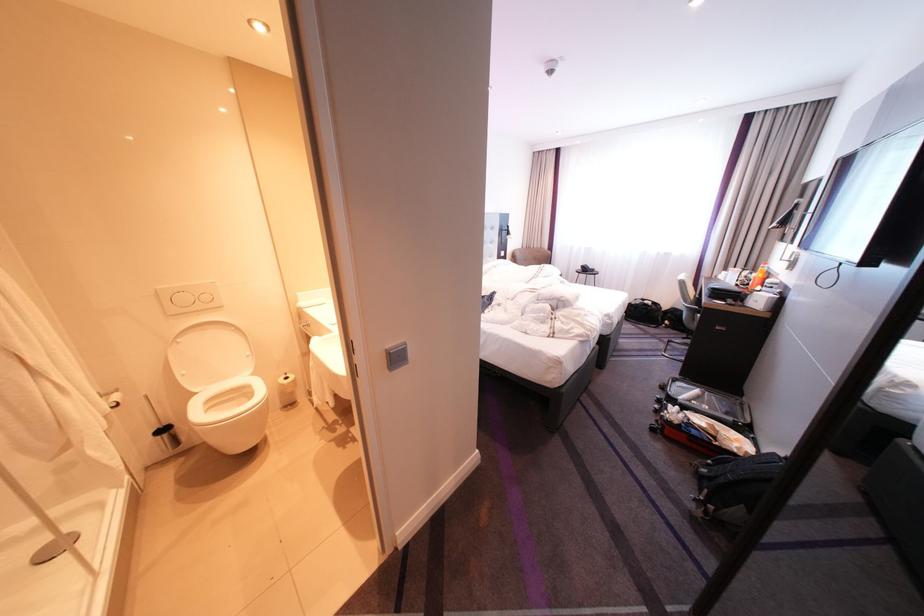
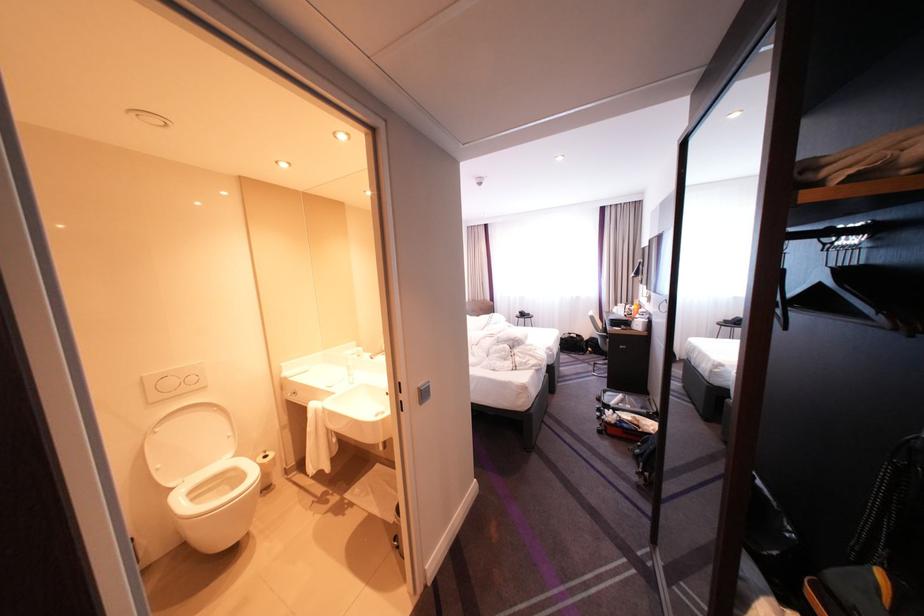
Where in the second image is the point corresponding to (x=397, y=351) from the first image?

(430, 389)